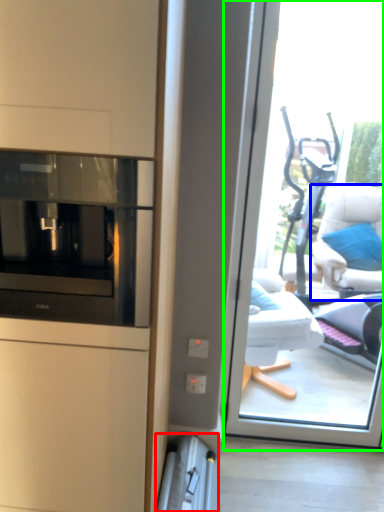
Question: Which object is the closest to the appliance (highlighted by a red box)? Choose among these: furniture (highlighted by a blue box) or window (highlighted by a green box).

Choices:
 (A) furniture
 (B) window

Answer: (B)